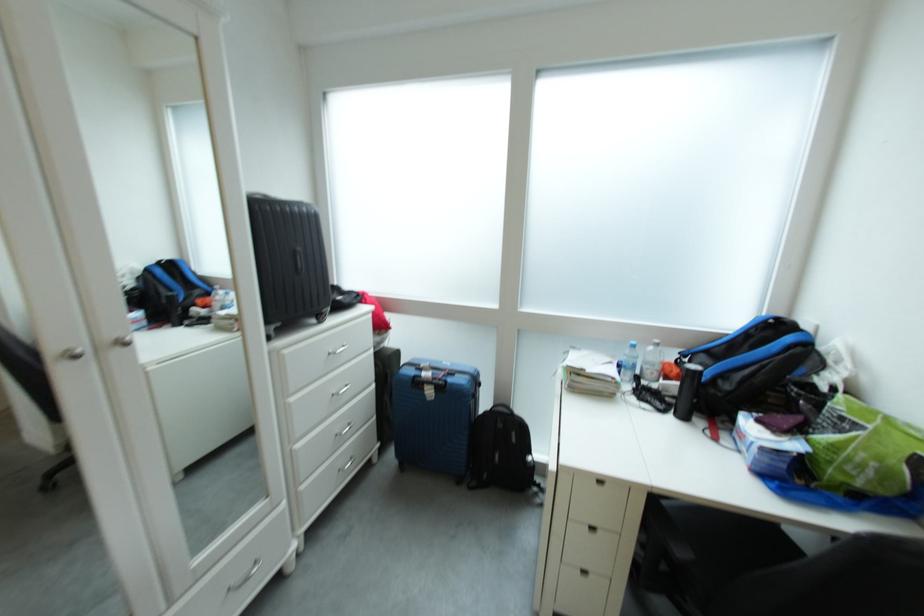
Where would you sit the chair sitting surface? Please return your answer as a coordinate pair (x, y).

(739, 543)